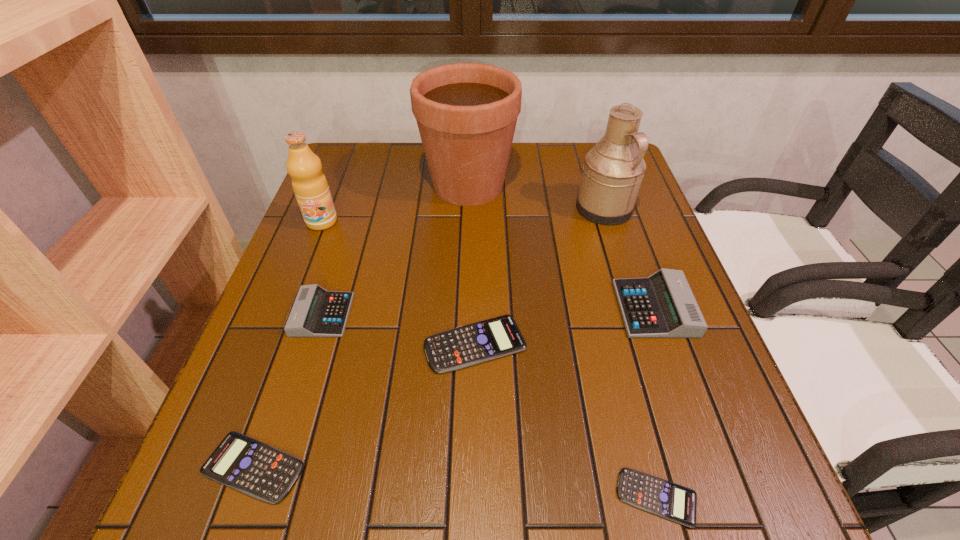
This screenshot has width=960, height=540. What are the coordinates of `empty space between the second blue calculator from left to right and the rightmost blue calculator` in the screenshot? It's located at (566, 420).

Find the location of a particular element. This screenshot has height=540, width=960. object that can be found as the fourth closest to the right gray calculator is located at coordinates (466, 113).

The height and width of the screenshot is (540, 960). Find the location of `object that is the seventh closest one to the pitcher`. object that is the seventh closest one to the pitcher is located at coordinates (259, 470).

You are a GUI agent. You are given a task and a screenshot of the screen. Output one action in this format:
    pyautogui.click(x=<x>, y=<y>)
    Task: Click on the third closest calculator to the fourth tallest calculator
    This screenshot has height=540, width=960.
    Given the screenshot: What is the action you would take?
    pyautogui.click(x=663, y=498)

I want to click on calculator that stands as the fourth closest to the pitcher, so click(663, 498).

Choose which blue calculator is the third nearest neighbor to the fruit juice. Please provide its 2D coordinates. Your answer should be formatted as a tuple, i.e. [(x, y)], where the tuple contains the x and y coordinates of a point satisfying the conditions above.

[(663, 498)]

Image resolution: width=960 pixels, height=540 pixels. What are the coordinates of `blue calculator that stands as the second closest to the leftmost blue calculator` in the screenshot? It's located at (663, 498).

In order to click on free location that satisfies the following two spatial constraints: 1. on the back side of the third shortest object; 2. on the left side of the pitcher in this screenshot , I will do `click(476, 209)`.

You are a GUI agent. You are given a task and a screenshot of the screen. Output one action in this format:
    pyautogui.click(x=<x>, y=<y>)
    Task: Click on the free region that satisfies the following two spatial constraints: 1. on the front side of the flowerpot; 2. on the left side of the fifth shortest object
    
    Given the screenshot: What is the action you would take?
    tap(465, 308)

The image size is (960, 540). In order to click on blank space that satisfies the following two spatial constraints: 1. on the front side of the flowerpot; 2. on the left side of the shortest calculator in this screenshot , I will do `click(458, 497)`.